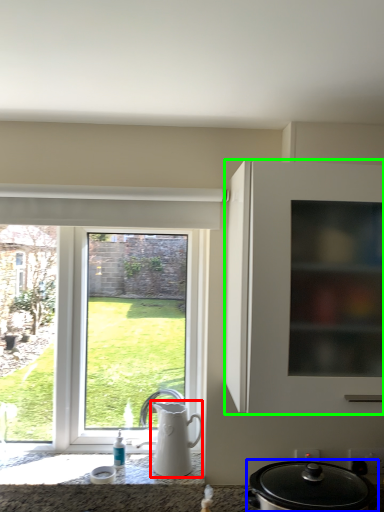
Question: Based on their relative distances, which object is farther from jug (highlighted by a red box)? Choose from kitchen appliance (highlighted by a blue box) and cabinetry (highlighted by a green box).

Choices:
 (A) kitchen appliance
 (B) cabinetry

Answer: (B)